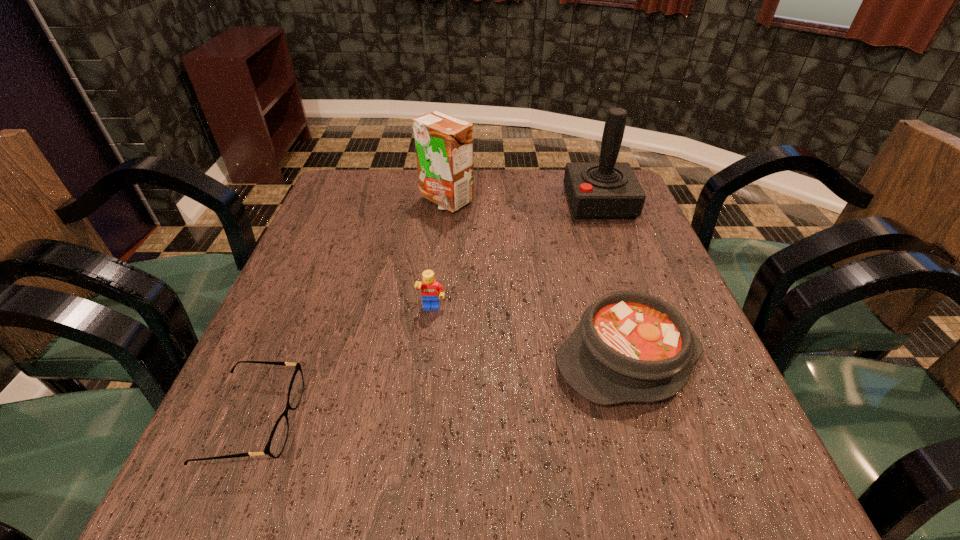
Identify the location of vacant region between the casserole and the Lego. The image size is (960, 540). (530, 334).

Locate an element on the screen. The height and width of the screenshot is (540, 960). vacant area between the carton and the Lego is located at coordinates click(439, 255).

Find the location of a particular element. This screenshot has width=960, height=540. unoccupied area between the casserole and the carton is located at coordinates (537, 280).

At what (x,y) coordinates should I click in order to perform the action: click on empty location between the joystick and the casserole. Please return your answer as a coordinate pair (x, y). The width and height of the screenshot is (960, 540). Looking at the image, I should click on (613, 281).

Locate an element on the screen. The width and height of the screenshot is (960, 540). empty location between the casserole and the Lego is located at coordinates (530, 334).

Locate an element on the screen. Image resolution: width=960 pixels, height=540 pixels. vacant point located between the carton and the leftmost object is located at coordinates (349, 311).

Locate which object is the closest to the spectacles. Please provide its 2D coordinates. Your answer should be formatted as a tuple, i.e. [(x, y)], where the tuple contains the x and y coordinates of a point satisfying the conditions above.

[(431, 290)]

Identify which object is the fourth nearest to the joystick. Please provide its 2D coordinates. Your answer should be formatted as a tuple, i.e. [(x, y)], where the tuple contains the x and y coordinates of a point satisfying the conditions above.

[(277, 440)]

At what (x,y) coordinates should I click in order to perform the action: click on vacant space that satisfies the following two spatial constraints: 1. on the straw side of the casserole; 2. on the right side of the carton. Please return your answer as a coordinate pair (x, y). Looking at the image, I should click on (x=429, y=359).

Where is `blank area in the image that satisfies the following two spatial constraints: 1. on the face of the Lego; 2. on the front-facing side of the shortest object`? The width and height of the screenshot is (960, 540). blank area in the image that satisfies the following two spatial constraints: 1. on the face of the Lego; 2. on the front-facing side of the shortest object is located at coordinates (420, 421).